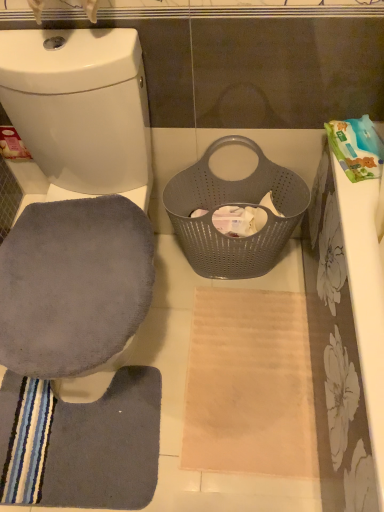
Question: In the image, is gray suede swivel chair at left positioned in front of or behind gray soft mat at lower left?

Choices:
 (A) behind
 (B) front

Answer: (B)

Question: From a real-world perspective, is gray suede swivel chair at left positioned above or below gray soft mat at lower left?

Choices:
 (A) above
 (B) below

Answer: (A)

Question: Estimate the real-world distances between objects in this image. Which object is closer to the gray perforated basket at center?

Choices:
 (A) gray soft mat at lower left
 (B) gray fabric toilet seat at left
 (C) white fabric toilet paper at center
 (D) gray suede swivel chair at left

Answer: (C)

Question: Estimate the real-world distances between objects in this image. Which object is farther from the gray suede swivel chair at left?

Choices:
 (A) gray perforated basket at center
 (B) white fabric toilet paper at center
 (C) gray soft mat at lower left
 (D) gray fabric toilet seat at left

Answer: (C)